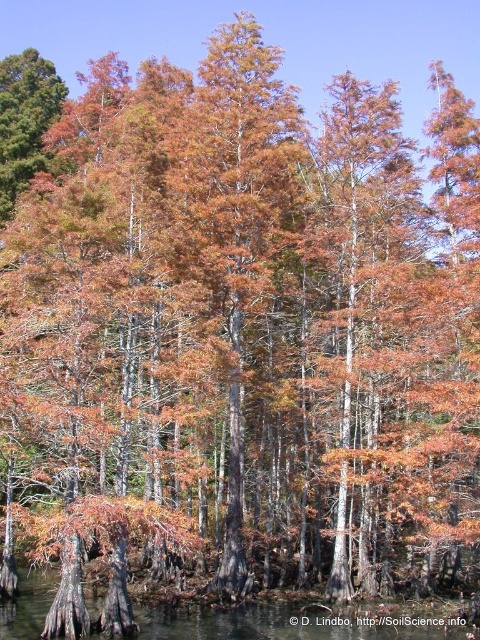
Question: Can you confirm if orange-brown bark tree at center is positioned below clear water at lower center?

Choices:
 (A) no
 (B) yes

Answer: (A)

Question: Observing the image, what is the correct spatial positioning of orange-brown bark tree at center in reference to clear water at lower center?

Choices:
 (A) below
 (B) above

Answer: (B)

Question: Is orange-brown bark tree at center in front of clear water at lower center?

Choices:
 (A) yes
 (B) no

Answer: (B)

Question: Which point appears farthest from the camera in this image?

Choices:
 (A) (448, 625)
 (B) (254, 243)

Answer: (B)

Question: Which point is closer to the camera?

Choices:
 (A) orange-brown bark tree at center
 (B) clear water at lower center

Answer: (B)